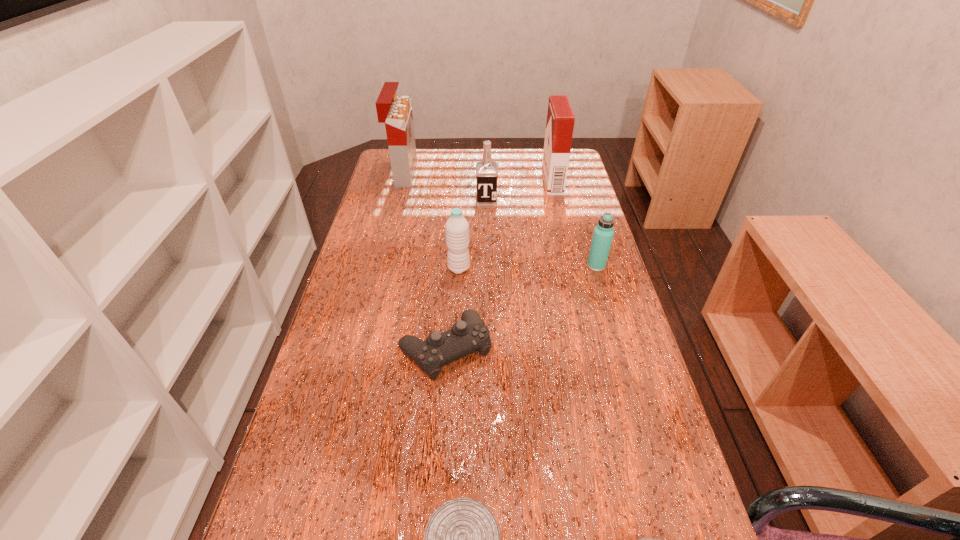
The width and height of the screenshot is (960, 540). I want to click on free region located on the front-facing side of the right cigarette_case, so click(512, 181).

You are a GUI agent. You are given a task and a screenshot of the screen. Output one action in this format:
    pyautogui.click(x=<x>, y=<y>)
    Task: Click on the free space located on the front label of the vodka
    This screenshot has height=540, width=960.
    Given the screenshot: What is the action you would take?
    coord(487,224)

Find the location of a particular element. free space located on the right of the water bottle is located at coordinates (529, 268).

The height and width of the screenshot is (540, 960). In order to click on free space located 0.050m on the left of the thermos bottle in this screenshot , I will do click(570, 266).

Identify the location of free spot located 0.190m on the back of the control. The width and height of the screenshot is (960, 540). (451, 267).

Identify the location of object that is positioned at the left edge. The width and height of the screenshot is (960, 540). (396, 112).

Image resolution: width=960 pixels, height=540 pixels. What are the coordinates of `cigarette_case located in the right edge section of the desktop` in the screenshot? It's located at (560, 118).

I want to click on thermos bottle located at the right edge, so click(x=603, y=233).

Image resolution: width=960 pixels, height=540 pixels. In order to click on object that is positioned at the far left corner in this screenshot , I will do `click(396, 112)`.

Find the location of a particular element. object that is at the far right corner is located at coordinates (560, 118).